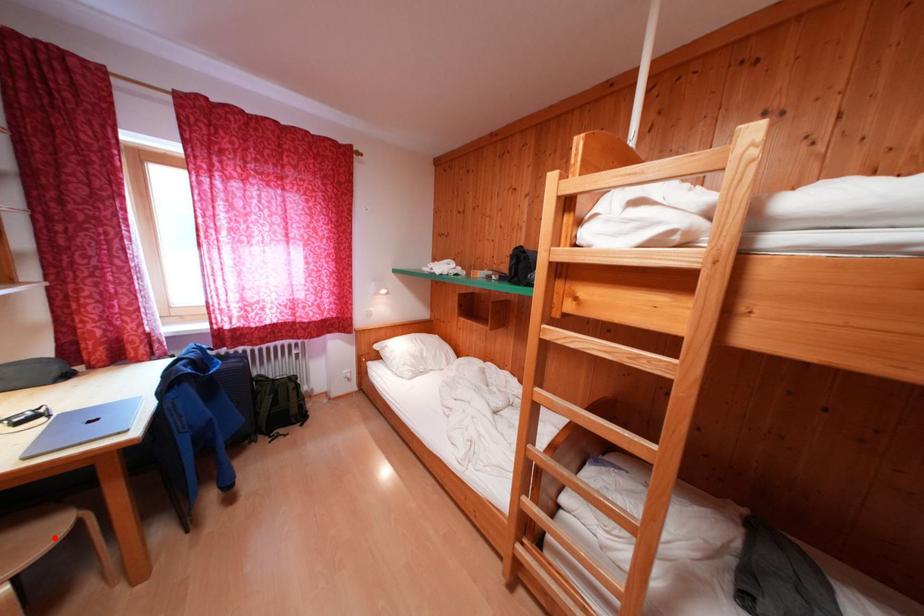
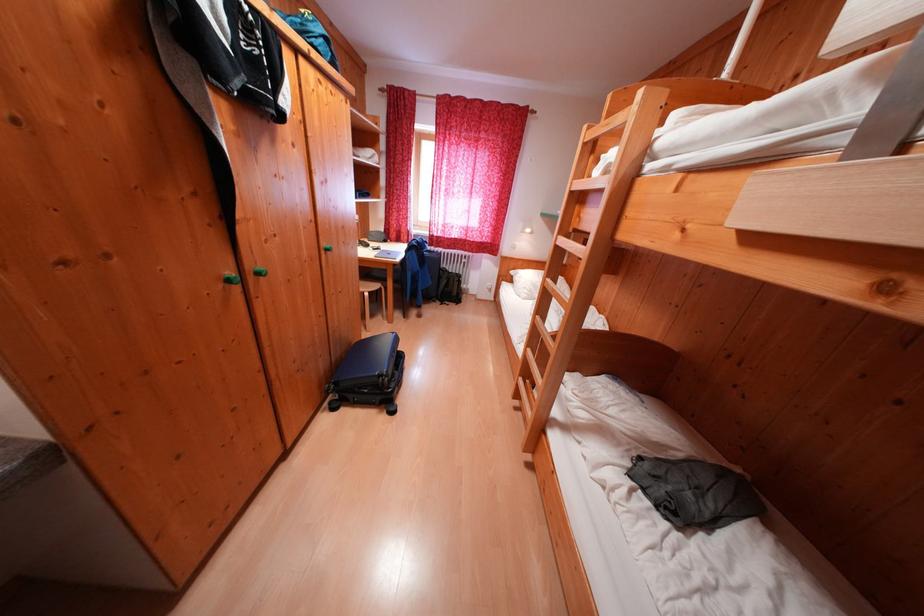
Find the pixel in the second image that matches the highlighted location in the first image.

(383, 290)